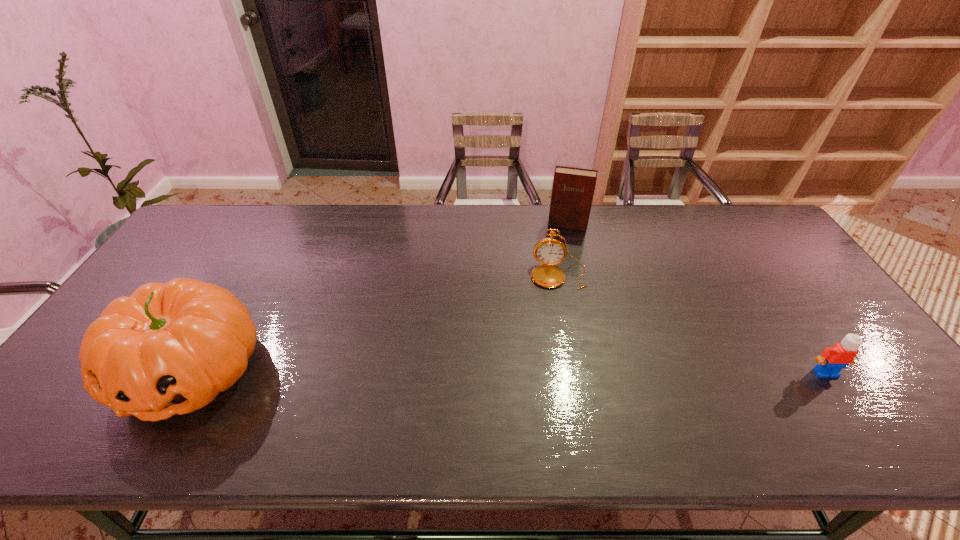
The height and width of the screenshot is (540, 960). I want to click on vacant space on the desktop that is between the leftmost object and the rightmost object and is positioned on the face of the second farthest object, so click(x=560, y=372).

Find the location of a particular element. vacant space on the desktop that is between the pumpkin and the Lego and is positioned on the front cover of the diary is located at coordinates (544, 372).